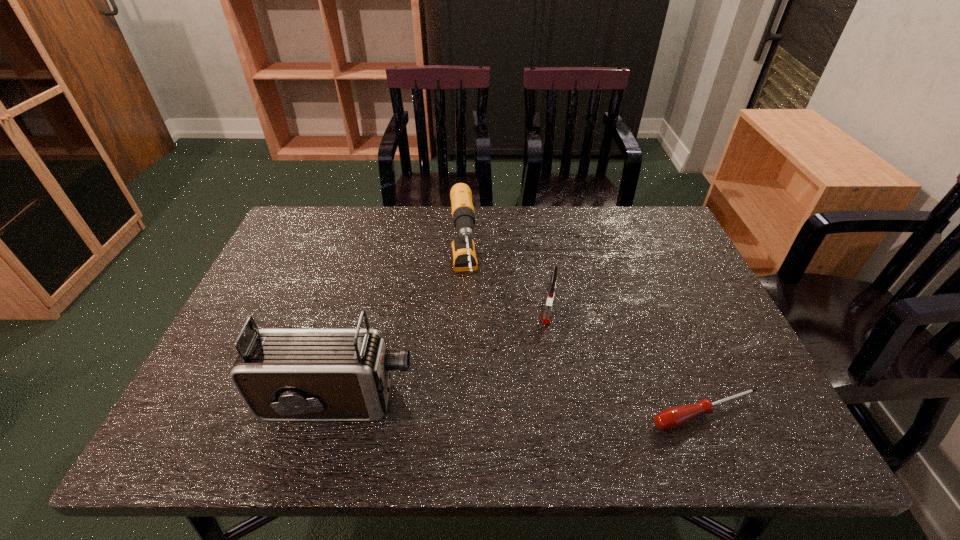
Identify the location of vacant point located between the leftmost object and the shortest object. Image resolution: width=960 pixels, height=540 pixels. (522, 407).

This screenshot has height=540, width=960. Identify the location of free spot between the leftmost object and the second object from left to right. (401, 339).

Where is `free space between the rightmost object and the drill`? The image size is (960, 540). free space between the rightmost object and the drill is located at coordinates (585, 345).

The image size is (960, 540). Identify the location of free space between the rightmost object and the camcorder. (522, 407).

Locate an element on the screen. The height and width of the screenshot is (540, 960). vacant area that lies between the camcorder and the stapler is located at coordinates (444, 354).

Where is `vacant space that is in between the third tallest object and the leftmost object`? vacant space that is in between the third tallest object and the leftmost object is located at coordinates (444, 354).

At what (x,y) coordinates should I click in order to perform the action: click on the second closest object to the drill. Please return your answer as a coordinate pair (x, y). Image resolution: width=960 pixels, height=540 pixels. Looking at the image, I should click on (282, 374).

Choose which object is the nearest neighbor to the third object from right to left. Please provide its 2D coordinates. Your answer should be formatted as a tuple, i.e. [(x, y)], where the tuple contains the x and y coordinates of a point satisfying the conditions above.

[(549, 302)]

The width and height of the screenshot is (960, 540). In order to click on free region that satisfies the following two spatial constraints: 1. on the front side of the rightmost object; 2. on the left side of the third object from right to left in this screenshot , I will do `click(458, 413)`.

Locate an element on the screen. This screenshot has height=540, width=960. free spot that satisfies the following two spatial constraints: 1. on the front side of the rightmost object; 2. on the left side of the third object from right to left is located at coordinates (458, 413).